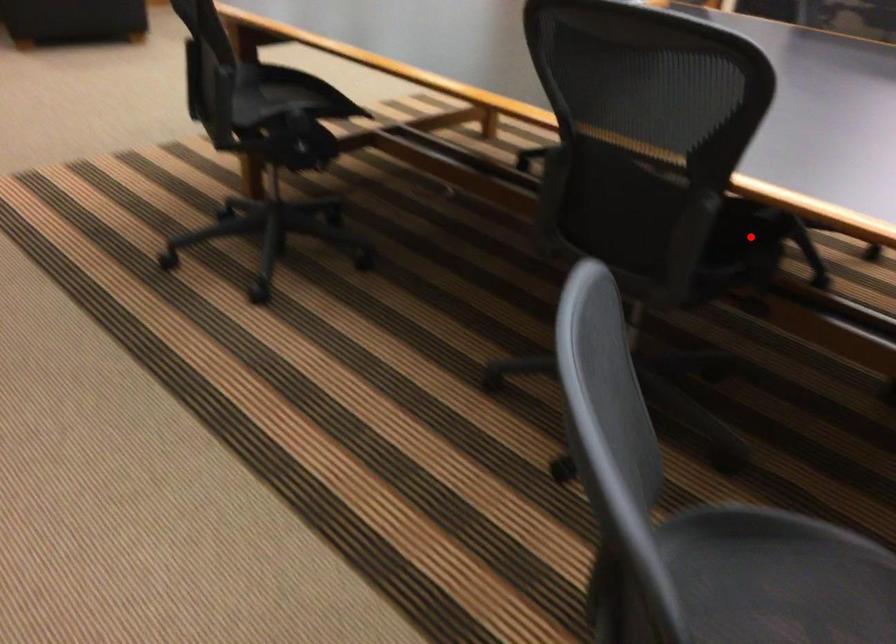
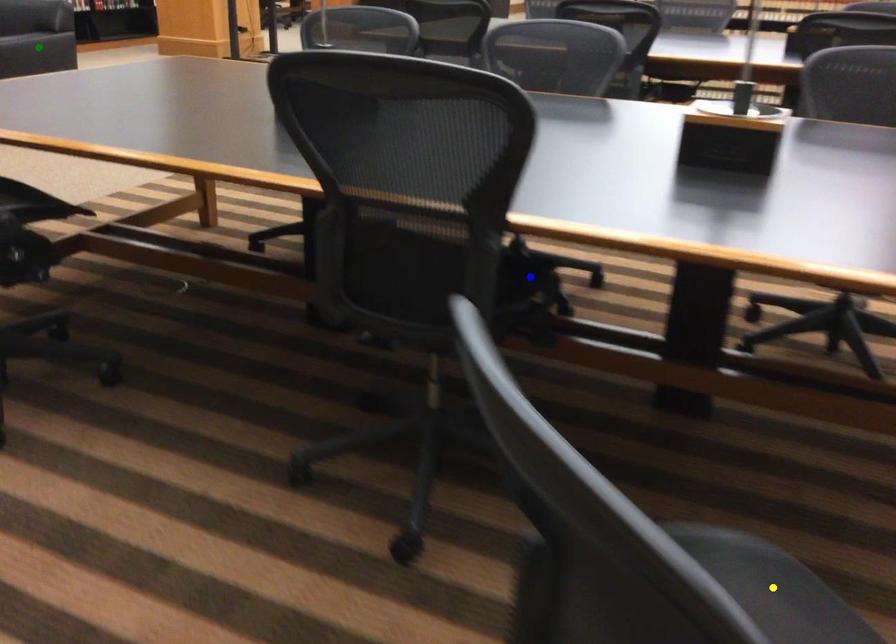
Question: I am providing you with two images of the same scene from different viewpoints. A red point is marked on the first image. You are given multiple points on the second image. Which point in image 2 represents the same 3d spot as the red point in image 1?

Choices:
 (A) blue point
 (B) green point
 (C) yellow point

Answer: (A)